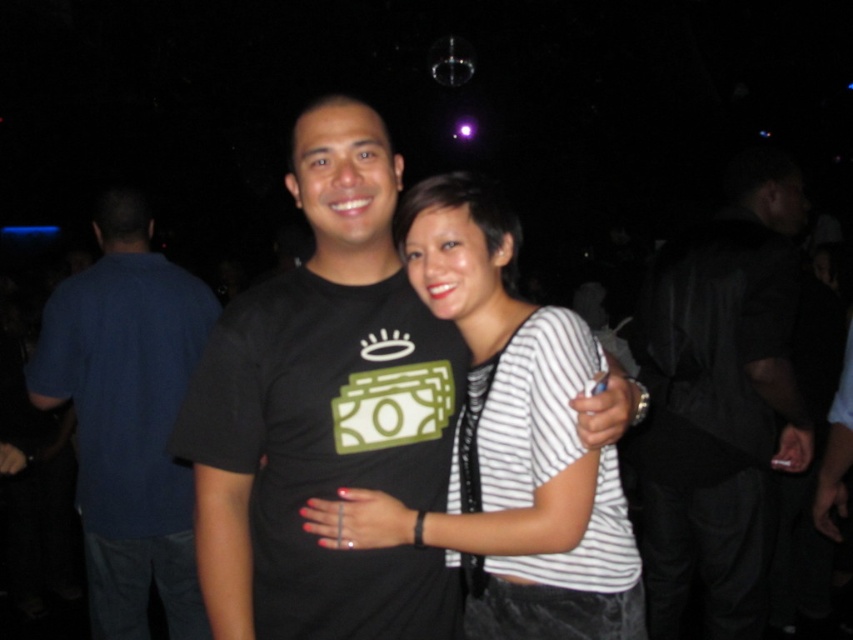
Where is `white striped shirt at center`? The image size is (853, 640). white striped shirt at center is located at coordinates (495, 432).

Does white striped shirt at center appear on the left side of dark blue shirt at left?

In fact, white striped shirt at center is to the right of dark blue shirt at left.

Who is more distant from viewer, (483, 625) or (100, 419)?

Point (100, 419)

At what (x,y) coordinates should I click in order to perform the action: click on white striped shirt at center. Please return your answer as a coordinate pair (x, y). The width and height of the screenshot is (853, 640). Looking at the image, I should click on (495, 432).

From the picture: Does black leather jacket at right have a greater height compared to white striped shirt at center?

Yes, black leather jacket at right is taller than white striped shirt at center.

Which is below, black leather jacket at right or white striped shirt at center?

Positioned lower is black leather jacket at right.

Where is `black leather jacket at right`? The width and height of the screenshot is (853, 640). black leather jacket at right is located at coordinates (720, 400).

Is black leather jacket at right bigger than dark blue shirt at left?

Yes, black leather jacket at right is bigger than dark blue shirt at left.

Is black leather jacket at right thinner than dark blue shirt at left?

No, black leather jacket at right is not thinner than dark blue shirt at left.

At what (x,y) coordinates should I click in order to perform the action: click on black leather jacket at right. Please return your answer as a coordinate pair (x, y). The height and width of the screenshot is (640, 853). Looking at the image, I should click on (x=720, y=400).